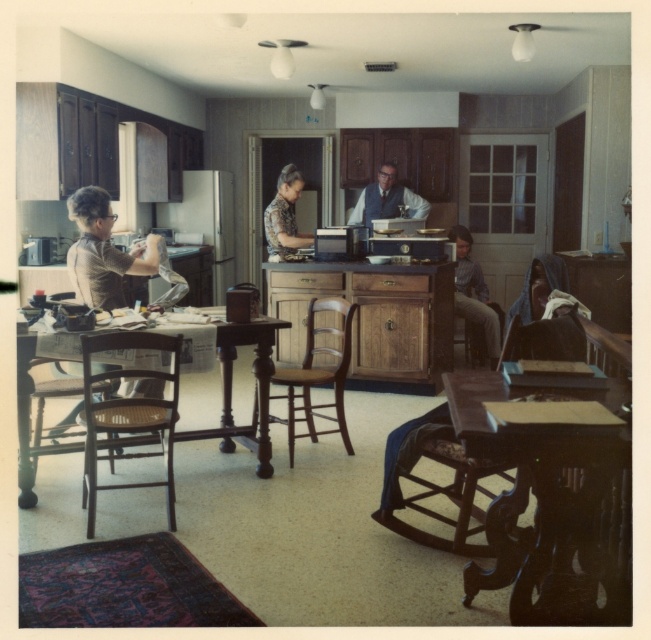
You are a delivery person trying to place a rectangular package that measures 15 inches in length on the floor between the brown wooden table at left and the wooden chair at center. Based on the space available, will the package fit without overlapping either the table or the chair?

The distance between the brown wooden table at left and the wooden chair at center is 14.75 inches. Since the package is 15 inches long, it will not fit entirely between them without overlapping either the table or the chair.

You are a guest entering the room and need to sit down. The brown wooden table at left is in your way. Can you walk around it to reach the wooden chair at center without moving the table?

The brown wooden table at left is not as tall as wooden chair at center, so you can walk around it to reach the wooden chair at center without moving the table since the table is shorter and won